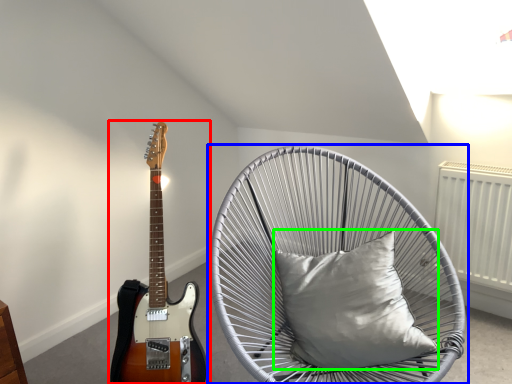
Question: Based on their relative distances, which object is nearer to guitar (highlighted by a red box)? Choose from chair (highlighted by a blue box) and pillow (highlighted by a green box).

Choices:
 (A) chair
 (B) pillow

Answer: (A)